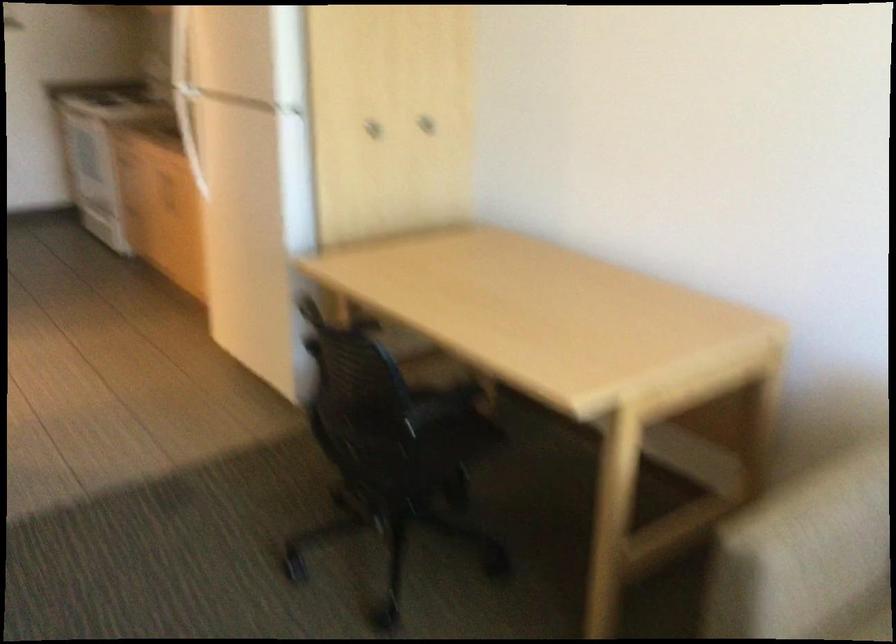
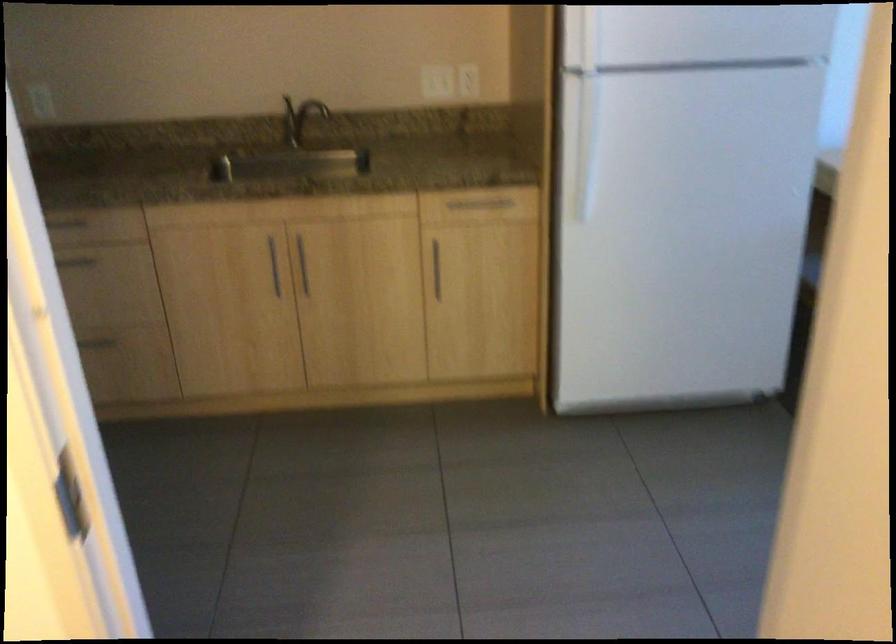
Question: I am providing you with two images of the same scene from different viewpoints. After the viewpoint changes to image2, which objects are now occluded?

Choices:
 (A) wall outlet
 (B) foosball table hole
 (C) cabinet door knob
 (D) refrigerator handle

Answer: (C)